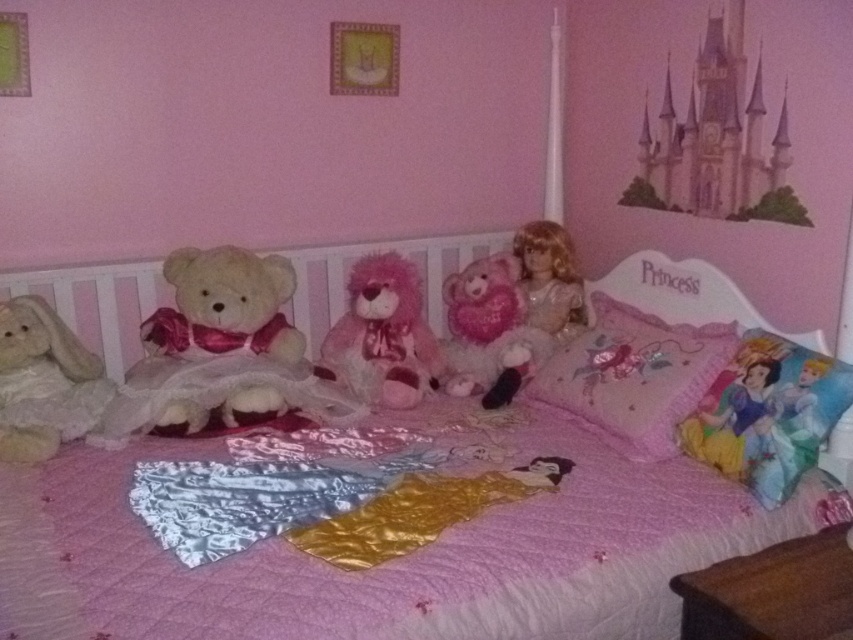
You are standing in the child bedroom and want to place a small nightlight. You have two points marked on the wall where you can place it. The first point is at coordinate point (590, 404) and the second point is at coordinate point (767, 410). Which point is closer to you so that the nightlight is easily reachable?

Point (590, 404) is closer to you than point (767, 410), so placing the nightlight there would make it more easily reachable.

Consider the image. You are a child trying to reach both the fluffy beige teddy bear at left and the pink plush teddy bear at center from your current position. Which teddy bear will you be able to grab first?

The fluffy beige teddy bear at left is closer to the viewer than the pink plush teddy bear at center, so you can grab the fluffy beige teddy bear at left first.

In the scene shown: You are standing at the point marked as point (51, 380). You want to reach the bed in the child bedroom. The bed is 6.63 feet away from you. Is the bed within a 5 feet radius from your current position?

The bed is 6.63 feet away from point (51, 380), so it is outside the 5 feet radius. You need to move further to reach it.